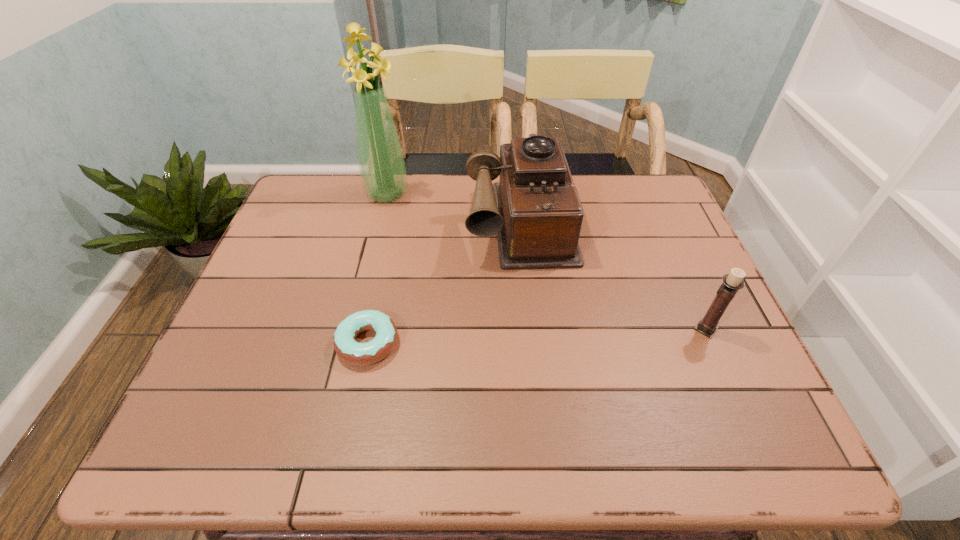
Locate an element on the screen. The image size is (960, 540). vacant space at the left edge is located at coordinates (265, 345).

Where is `vacant space at the right edge of the desktop`? This screenshot has width=960, height=540. vacant space at the right edge of the desktop is located at coordinates (686, 277).

Image resolution: width=960 pixels, height=540 pixels. What are the coordinates of `vacant region at the far left corner of the desktop` in the screenshot? It's located at (301, 179).

I want to click on vacant region at the near left corner of the desktop, so click(240, 388).

Find the location of a particular element. The width and height of the screenshot is (960, 540). vacant space at the far right corner of the desktop is located at coordinates (660, 188).

You are a GUI agent. You are given a task and a screenshot of the screen. Output one action in this format:
    pyautogui.click(x=<x>, y=<y>)
    Task: Click on the blank region between the doughnut and the tallest object
    
    Given the screenshot: What is the action you would take?
    pyautogui.click(x=377, y=268)

Image resolution: width=960 pixels, height=540 pixels. What are the coordinates of `vacant space in between the tallest object and the shortest object` in the screenshot? It's located at coord(377,268).

The image size is (960, 540). In order to click on vacant area between the bouquet and the shortest object in this screenshot , I will do `click(377, 268)`.

Image resolution: width=960 pixels, height=540 pixels. In order to click on vacant space in between the third object from left to right and the candle holder in this screenshot , I will do `click(612, 274)`.

I want to click on free space between the second shortest object and the third shortest object, so click(612, 274).